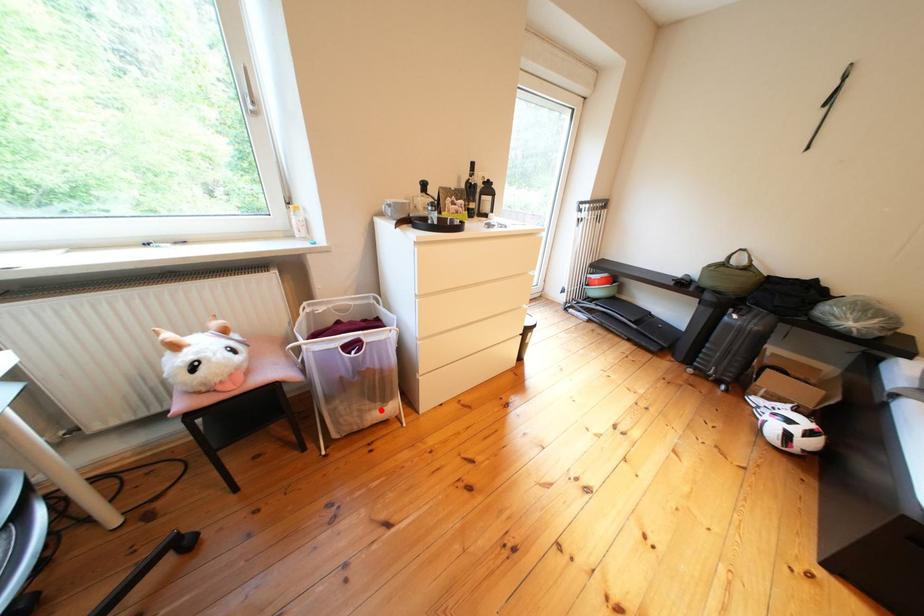
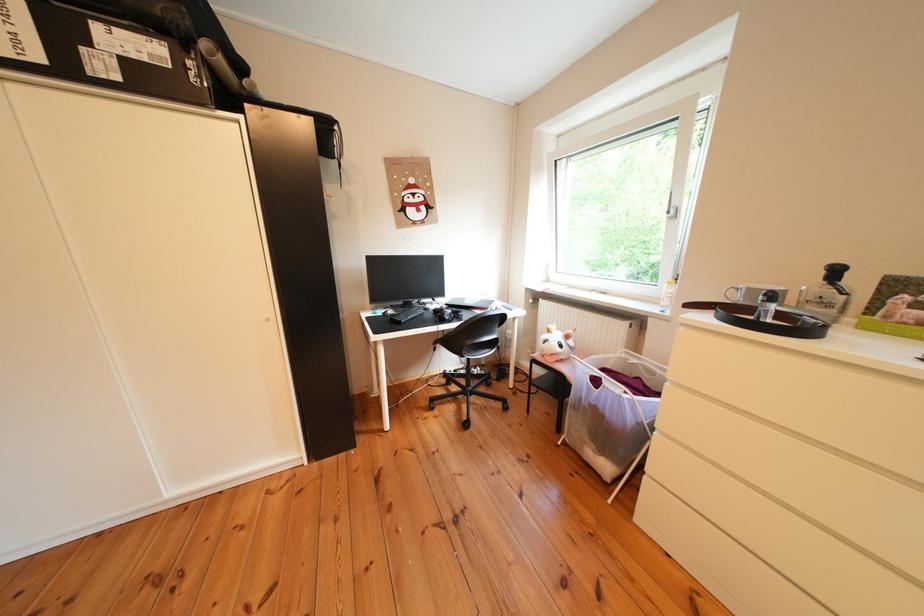
Question: I am providing you with two images of the same scene from different viewpoints. A red point is shown in image1. For the corresponding object point in image2, is it positioned nearer or farther from the camera?

Choices:
 (A) Nearer
 (B) Farther

Answer: (A)